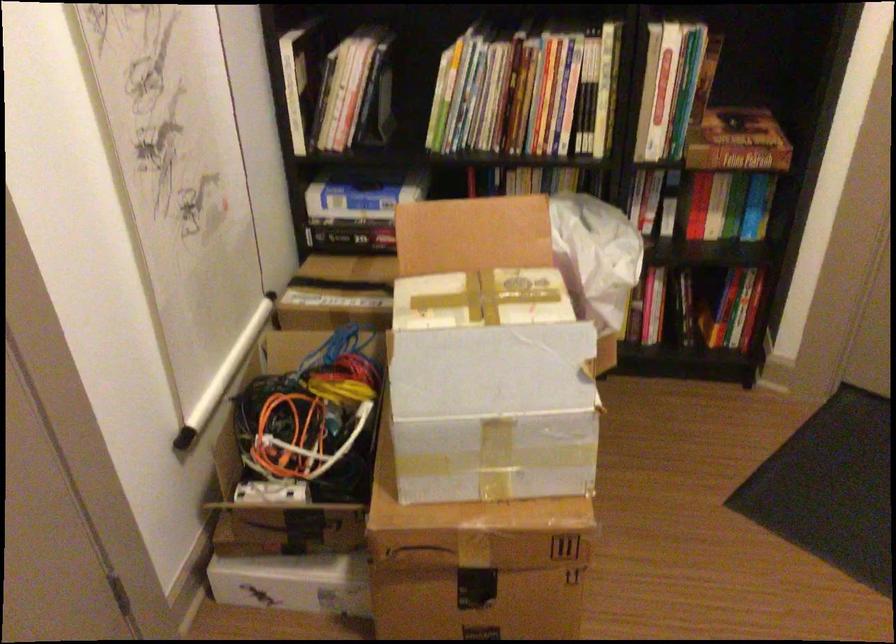
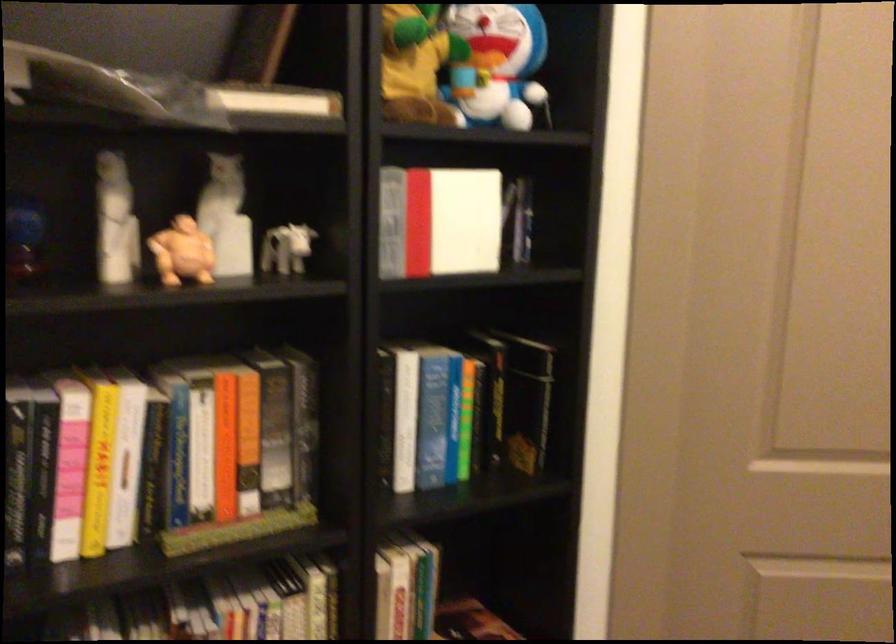
The images are taken continuously from a first-person perspective. In which direction is your viewpoint rotating?

The camera rotated toward right-up.